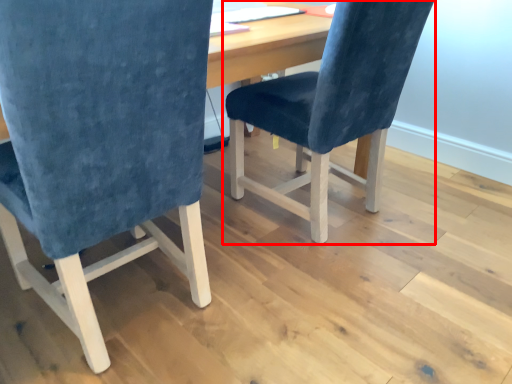
Question: From the image's perspective, where is chair (annotated by the red box) located in relation to chair in the image?

Choices:
 (A) above
 (B) below

Answer: (A)